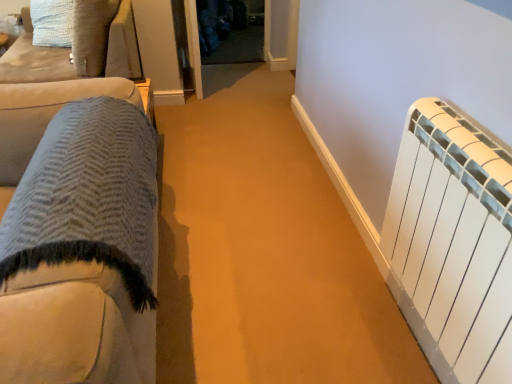
Question: In terms of width, does textured wool blanket at left, positioned as the 2th furniture in top-to-bottom order, look wider or thinner when compared to transparent glass door at center?

Choices:
 (A) thin
 (B) wide

Answer: (A)

Question: From their relative heights in the image, would you say textured wool blanket at left, which is counted as the 2th furniture, starting from the back, is taller or shorter than transparent glass door at center?

Choices:
 (A) short
 (B) tall

Answer: (B)

Question: Estimate the real-world distances between objects in this image. Which object is closer to the textured wool blanket at left, placed as the second furniture when sorted from left to right?

Choices:
 (A) white matte radiator at right
 (B) transparent glass door at center
 (C) suede cushion at upper left, positioned as the second furniture in bottom-to-top order

Answer: (A)

Question: Which is nearer to the white matte radiator at right?

Choices:
 (A) transparent glass door at center
 (B) suede cushion at upper left, arranged as the second furniture when viewed from the front
 (C) textured wool blanket at left, which is counted as the 2th furniture, starting from the back

Answer: (C)